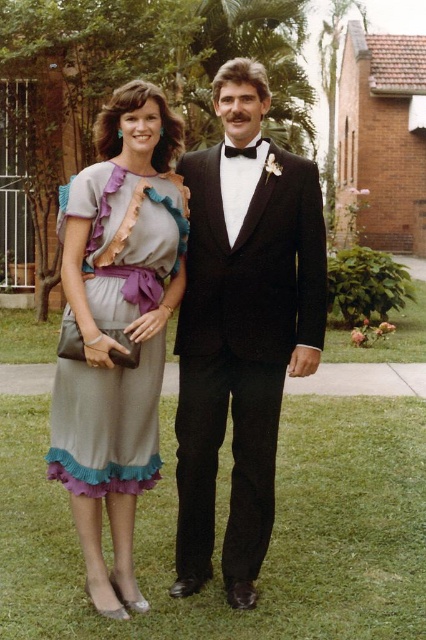
Can you confirm if matte gray dress with ruffled trim at center is positioned above black satin bow tie at center?

Actually, matte gray dress with ruffled trim at center is below black satin bow tie at center.

Image resolution: width=426 pixels, height=640 pixels. What do you see at coordinates (106, 424) in the screenshot?
I see `matte gray dress with ruffled trim at center` at bounding box center [106, 424].

Who is more distant from viewer, (68, 416) or (226, 156)?

Positioned behind is point (226, 156).

Find the location of a particular element. matte gray dress with ruffled trim at center is located at coordinates (106, 424).

Between point (247, 209) and point (146, 291), which one is positioned in front?

Point (146, 291) is in front.

Can you confirm if black satin tuxedo at center is bigger than matte gray dress with ruffled trim at center?

Correct, black satin tuxedo at center is larger in size than matte gray dress with ruffled trim at center.

Identify the location of black satin tuxedo at center. This screenshot has height=640, width=426. (241, 328).

Identify the location of black satin tuxedo at center. Image resolution: width=426 pixels, height=640 pixels. (241, 328).

Is black satin tuxedo at center to the left of black satin bow tie at center from the viewer's perspective?

Incorrect, black satin tuxedo at center is not on the left side of black satin bow tie at center.

Does black satin tuxedo at center appear over black satin bow tie at center?

No, black satin tuxedo at center is not above black satin bow tie at center.

What are the coordinates of `black satin tuxedo at center` in the screenshot? It's located at (241, 328).

The image size is (426, 640). What are the coordinates of `black satin tuxedo at center` in the screenshot? It's located at (241, 328).